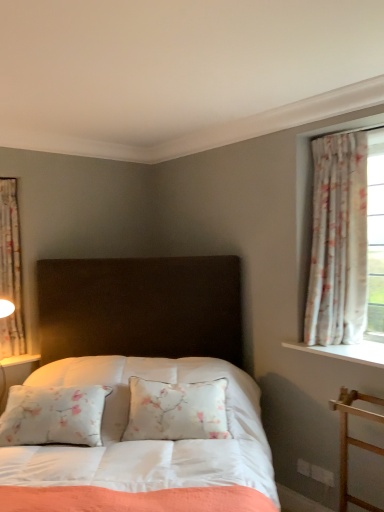
Question: Considering the positions of satin white bed at center and floral fabric curtain at left, acting as the second curtain starting from the front, in the image, is satin white bed at center taller or shorter than floral fabric curtain at left, acting as the second curtain starting from the front,?

Choices:
 (A) short
 (B) tall

Answer: (B)

Question: Which is correct: satin white bed at center is inside floral fabric curtain at left, placed as the 2th curtain when sorted from right to left, or outside of it?

Choices:
 (A) outside
 (B) inside

Answer: (A)

Question: Estimate the real-world distances between objects in this image. Which object is farther from the floral fabric curtain at right, which is the second curtain from left to right?

Choices:
 (A) floral fabric curtain at left, acting as the first curtain starting from the left
 (B) satin white bed at center

Answer: (A)

Question: Estimate the real-world distances between objects in this image. Which object is farther from the floral fabric curtain at right, the 2th curtain positioned from the back?

Choices:
 (A) floral fabric curtain at left, acting as the first curtain starting from the left
 (B) satin white bed at center

Answer: (A)